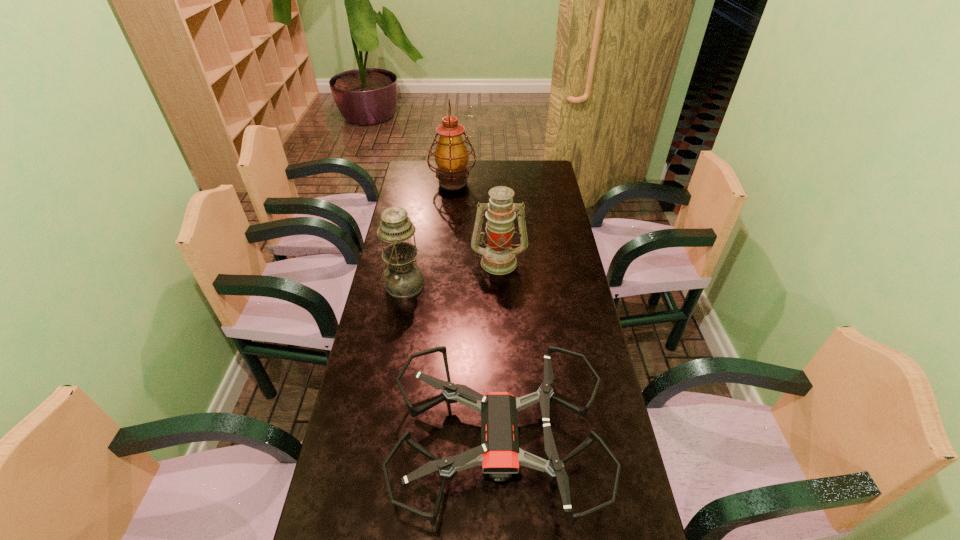
In order to click on object that is positioned at the far left corner in this screenshot , I will do `click(451, 156)`.

Where is `free space at the left edge of the desktop`? This screenshot has width=960, height=540. free space at the left edge of the desktop is located at coordinates (392, 347).

In the image, there is a desktop. Where is `vacant space at the right edge`? Image resolution: width=960 pixels, height=540 pixels. vacant space at the right edge is located at coordinates (577, 439).

The height and width of the screenshot is (540, 960). What are the coordinates of `vacant region at the far left corner of the desktop` in the screenshot? It's located at (412, 174).

The width and height of the screenshot is (960, 540). In order to click on free space between the nearest object and the tallest oil lamp in this screenshot , I will do `click(476, 312)`.

You are a GUI agent. You are given a task and a screenshot of the screen. Output one action in this format:
    pyautogui.click(x=<x>, y=<y>)
    Task: Click on the closest object relative to the drone
    This screenshot has height=540, width=960.
    Given the screenshot: What is the action you would take?
    pyautogui.click(x=403, y=279)

Identify which object is located as the second nearest to the nearest object. Please provide its 2D coordinates. Your answer should be formatted as a tuple, i.e. [(x, y)], where the tuple contains the x and y coordinates of a point satisfying the conditions above.

[(498, 258)]

Locate which oil lamp ranks second in proximity to the tallest object. Please provide its 2D coordinates. Your answer should be formatted as a tuple, i.e. [(x, y)], where the tuple contains the x and y coordinates of a point satisfying the conditions above.

[(403, 279)]

Locate which oil lamp is the third closest to the shortest object. Please provide its 2D coordinates. Your answer should be formatted as a tuple, i.e. [(x, y)], where the tuple contains the x and y coordinates of a point satisfying the conditions above.

[(451, 156)]